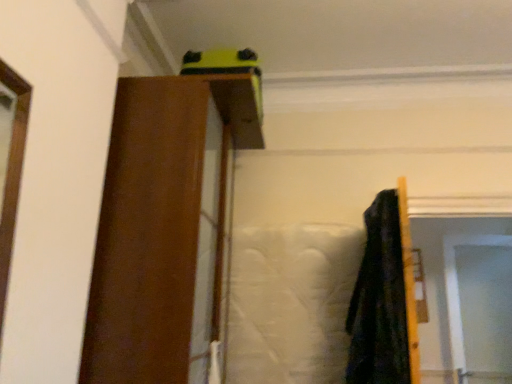
Where is `transparent plastic screen door at upper right`? The width and height of the screenshot is (512, 384). transparent plastic screen door at upper right is located at coordinates (458, 289).

The height and width of the screenshot is (384, 512). What do you see at coordinates (458, 289) in the screenshot? I see `transparent plastic screen door at upper right` at bounding box center [458, 289].

What do you see at coordinates (147, 235) in the screenshot?
I see `brown wood barn door at upper center` at bounding box center [147, 235].

The height and width of the screenshot is (384, 512). Find the location of `brown wood barn door at upper center`. brown wood barn door at upper center is located at coordinates (147, 235).

Where is `transparent plastic screen door at upper right`? transparent plastic screen door at upper right is located at coordinates (458, 289).

Which is more to the right, transparent plastic screen door at upper right or brown wood barn door at upper center?

transparent plastic screen door at upper right is more to the right.

In the image, is transparent plastic screen door at upper right positioned in front of or behind brown wood barn door at upper center?

In the image, transparent plastic screen door at upper right appears behind brown wood barn door at upper center.

Considering the positions of point (448, 293) and point (111, 176), is point (448, 293) closer or farther from the camera than point (111, 176)?

Point (448, 293) is farther from the camera than point (111, 176).

From the image's perspective, is transparent plastic screen door at upper right above or below brown wood barn door at upper center?

Clearly, from the image's perspective, transparent plastic screen door at upper right is below brown wood barn door at upper center.

From a real-world perspective, is transparent plastic screen door at upper right positioned above or below brown wood barn door at upper center?

In terms of real-world spatial position, transparent plastic screen door at upper right is below brown wood barn door at upper center.

Is transparent plastic screen door at upper right thinner than brown wood barn door at upper center?

Correct, the width of transparent plastic screen door at upper right is less than that of brown wood barn door at upper center.

Considering the relative sizes of transparent plastic screen door at upper right and brown wood barn door at upper center in the image provided, is transparent plastic screen door at upper right shorter than brown wood barn door at upper center?

Correct, transparent plastic screen door at upper right is not as tall as brown wood barn door at upper center.

Based on the photo, is transparent plastic screen door at upper right bigger than brown wood barn door at upper center?

No.

Looking at this image, could brown wood barn door at upper center be considered to be inside transparent plastic screen door at upper right?

No, brown wood barn door at upper center is not a part of transparent plastic screen door at upper right.

Is transparent plastic screen door at upper right positioned far away from brown wood barn door at upper center?

Indeed, transparent plastic screen door at upper right is not near brown wood barn door at upper center.

Is transparent plastic screen door at upper right looking in the opposite direction of brown wood barn door at upper center?

transparent plastic screen door at upper right is not turned away from brown wood barn door at upper center.

How far apart are transparent plastic screen door at upper right and brown wood barn door at upper center?

transparent plastic screen door at upper right is 2.82 meters from brown wood barn door at upper center.

The width and height of the screenshot is (512, 384). I want to click on screen door below the brown wood barn door at upper center (from a real-world perspective), so click(458, 289).

Is brown wood barn door at upper center to the left of transparent plastic screen door at upper right from the viewer's perspective?

Yes, brown wood barn door at upper center is to the left of transparent plastic screen door at upper right.

Is brown wood barn door at upper center positioned behind transparent plastic screen door at upper right?

No, brown wood barn door at upper center is in front of transparent plastic screen door at upper right.

Which is nearer, (165, 250) or (457, 357)?

Point (165, 250) is positioned closer to the camera compared to point (457, 357).

From the image's perspective, which object appears higher, brown wood barn door at upper center or transparent plastic screen door at upper right?

brown wood barn door at upper center is shown above in the image.

From a real-world perspective, is brown wood barn door at upper center positioned over transparent plastic screen door at upper right based on gravity?

Yes, from a real-world perspective, brown wood barn door at upper center is over transparent plastic screen door at upper right

From the picture: Looking at their sizes, would you say brown wood barn door at upper center is wider or thinner than transparent plastic screen door at upper right?

Clearly, brown wood barn door at upper center has more width compared to transparent plastic screen door at upper right.

Considering the relative sizes of brown wood barn door at upper center and transparent plastic screen door at upper right in the image provided, is brown wood barn door at upper center taller than transparent plastic screen door at upper right?

Yes, brown wood barn door at upper center is taller than transparent plastic screen door at upper right.

Looking at the image, does brown wood barn door at upper center seem bigger or smaller compared to transparent plastic screen door at upper right?

brown wood barn door at upper center is bigger than transparent plastic screen door at upper right.

Is brown wood barn door at upper center located outside transparent plastic screen door at upper right?

That's correct, brown wood barn door at upper center is outside of transparent plastic screen door at upper right.

Is there a large distance between brown wood barn door at upper center and transparent plastic screen door at upper right?

brown wood barn door at upper center is far away from transparent plastic screen door at upper right.

Could you tell me if brown wood barn door at upper center is facing transparent plastic screen door at upper right?

No, brown wood barn door at upper center does not turn towards transparent plastic screen door at upper right.

In the scene shown: What's the angular difference between brown wood barn door at upper center and transparent plastic screen door at upper right's facing directions?

82.7 degrees.

Measure the distance between brown wood barn door at upper center and transparent plastic screen door at upper right.

The distance of brown wood barn door at upper center from transparent plastic screen door at upper right is 9.26 feet.

Where is `screen door below the brown wood barn door at upper center (from the image's perspective)`? This screenshot has width=512, height=384. screen door below the brown wood barn door at upper center (from the image's perspective) is located at coordinates (458, 289).

Find the location of a particular element. screen door located behind the brown wood barn door at upper center is located at coordinates (458, 289).

Locate an element on the screen. Image resolution: width=512 pixels, height=384 pixels. screen door on the right side of brown wood barn door at upper center is located at coordinates (458, 289).